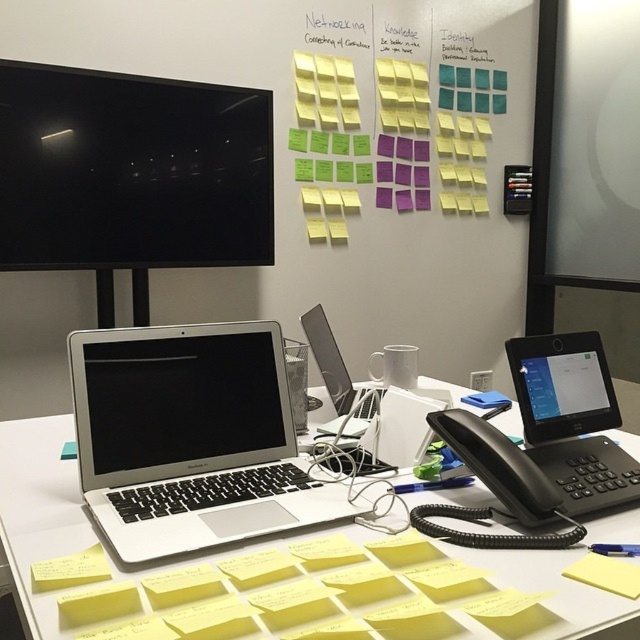
You need to place a new object between the silver metallic laptop at lower left and the yellow paper at lower right. Considering their widths, which side should the new object be placed closer to?

The silver metallic laptop at lower left is wider than the yellow paper at lower right, so the new object should be placed closer to the yellow paper at lower right to maintain balance.

In the scene shown: You are organizing the desk and need to place a new item between the black glossy monitor at upper left and the silver metallic laptop at lower left. Considering their heights, which one should you place the item closer to to ensure stability?

The black glossy monitor at upper left is taller than the silver metallic laptop at lower left, so placing the item closer to the monitor would provide better stability due to its greater height.

You are organizing the desk and need to place the silver metallic laptop at center and the yellow paper at lower left into a drawer. The drawer can only fit items smaller than the laptop. Which item should you place first to ensure both fit?

The yellow paper at lower left is smaller than the silver metallic laptop at center, so you should place the silver metallic laptop at center first to make space for the smaller item.